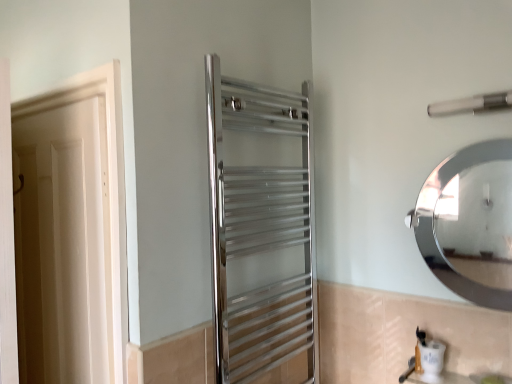
Question: Is polished chrome towel rack at center, placed as the 1th screen door when sorted from right to left, looking in the opposite direction of white matte door at left?

Choices:
 (A) no
 (B) yes

Answer: (A)

Question: From the image's perspective, is polished chrome towel rack at center, the second screen door positioned from the left, on top of white matte door at left?

Choices:
 (A) no
 (B) yes

Answer: (B)

Question: Is polished chrome towel rack at center, placed as the 1th screen door when sorted from right to left, outside of white matte door at left?

Choices:
 (A) yes
 (B) no

Answer: (A)

Question: Is polished chrome towel rack at center, the second screen door positioned from the left, further to the viewer compared to white matte door at left?

Choices:
 (A) yes
 (B) no

Answer: (B)

Question: From a real-world perspective, is polished chrome towel rack at center, the second screen door positioned from the left, over white matte door at left?

Choices:
 (A) no
 (B) yes

Answer: (B)

Question: Looking at their shapes, would you say white wood screen door at left, arranged as the 1th screen door when viewed from the left, is wider or thinner than polished chrome towel rack at center, placed as the 1th screen door when sorted from right to left?

Choices:
 (A) wide
 (B) thin

Answer: (B)

Question: From the image's perspective, is white wood screen door at left, arranged as the 1th screen door when viewed from the left, located above or below polished chrome towel rack at center, placed as the 1th screen door when sorted from right to left?

Choices:
 (A) above
 (B) below

Answer: (B)

Question: From a real-world perspective, is white wood screen door at left, arranged as the 1th screen door when viewed from the left, positioned above or below polished chrome towel rack at center, placed as the 1th screen door when sorted from right to left?

Choices:
 (A) below
 (B) above

Answer: (A)

Question: Considering the relative positions of white wood screen door at left, the second screen door from the right, and polished chrome towel rack at center, placed as the 1th screen door when sorted from right to left, in the image provided, is white wood screen door at left, the second screen door from the right, to the left or to the right of polished chrome towel rack at center, placed as the 1th screen door when sorted from right to left,?

Choices:
 (A) right
 (B) left

Answer: (B)

Question: Would you say polished chrome towel rack at center, the second screen door positioned from the left, is inside or outside white wood screen door at left, the second screen door from the right?

Choices:
 (A) inside
 (B) outside

Answer: (B)

Question: Looking at their shapes, would you say polished chrome towel rack at center, the second screen door positioned from the left, is wider or thinner than white wood screen door at left, the second screen door from the right?

Choices:
 (A) thin
 (B) wide

Answer: (B)

Question: Relative to white wood screen door at left, arranged as the 1th screen door when viewed from the left, is polished chrome towel rack at center, the second screen door positioned from the left, in front or behind?

Choices:
 (A) behind
 (B) front

Answer: (A)

Question: In the image, is polished chrome towel rack at center, the second screen door positioned from the left, on the left side or the right side of white wood screen door at left, the second screen door from the right?

Choices:
 (A) right
 (B) left

Answer: (A)

Question: Based on their sizes in the image, would you say white matte door at left is bigger or smaller than satin nickel towel bar at upper right?

Choices:
 (A) big
 (B) small

Answer: (A)

Question: Is white matte door at left wider or thinner than satin nickel towel bar at upper right?

Choices:
 (A) thin
 (B) wide

Answer: (A)